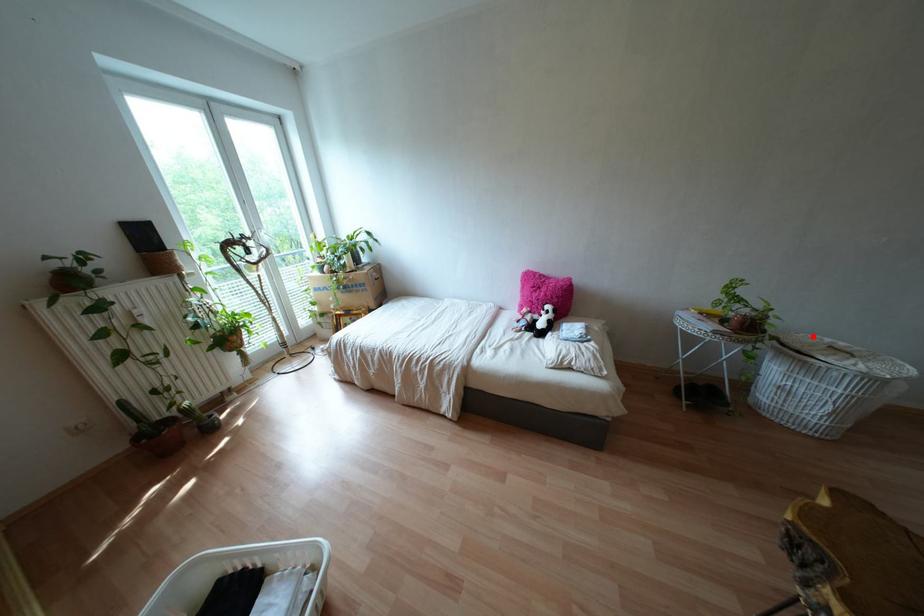
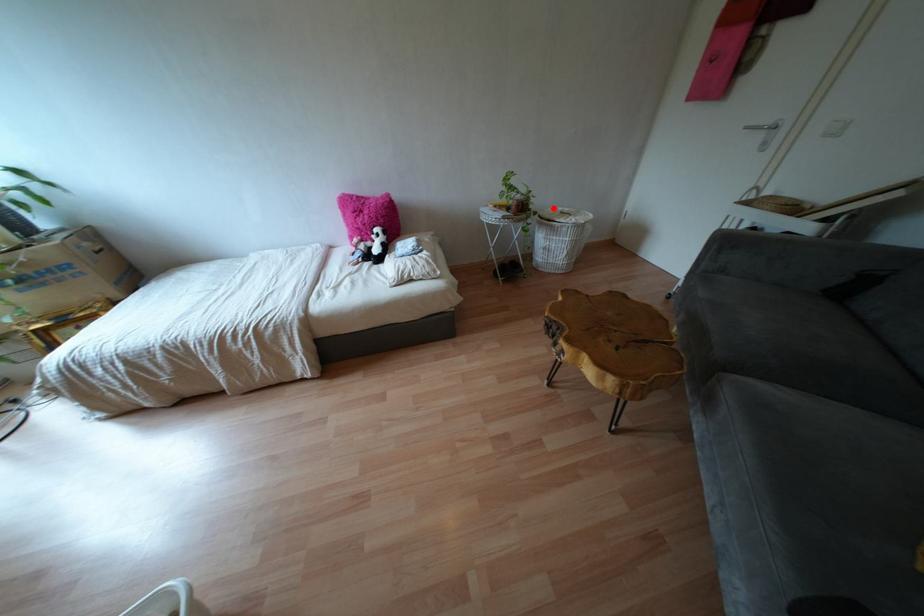
I am providing you with two images of the same scene from different viewpoints. A red point is marked on the first image and another point is marked on the second image. Are the points marked in image1 and image2 representing the same 3D position?

Yes